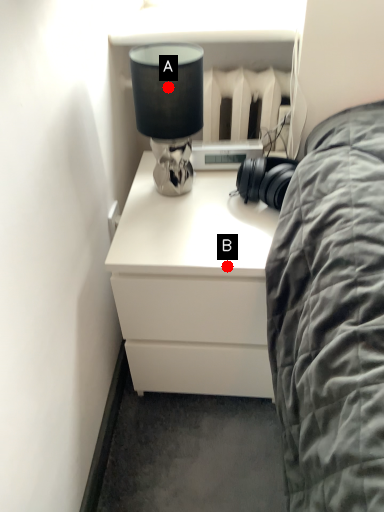
Question: Two points are circled on the image, labeled by A and B beside each circle. Which point is closer to the camera?

Choices:
 (A) A is closer
 (B) B is closer

Answer: (A)